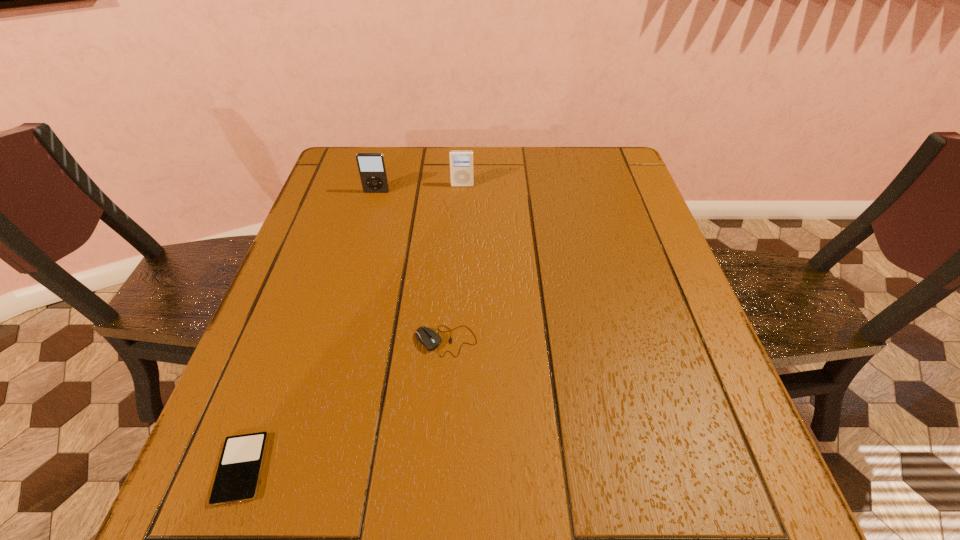
The height and width of the screenshot is (540, 960). I want to click on vacant position located on the right of the computer mouse, so click(624, 341).

This screenshot has width=960, height=540. What are the coordinates of `vacant space positioned on the back of the nearest iPod` in the screenshot? It's located at (314, 273).

The width and height of the screenshot is (960, 540). What are the coordinates of `object that is at the near edge` in the screenshot? It's located at coord(238,474).

The height and width of the screenshot is (540, 960). I want to click on object that is at the far left corner, so [371, 166].

Locate an element on the screen. object at the near left corner is located at coordinates (238, 474).

Locate an element on the screen. vacant space at the far edge of the desktop is located at coordinates (421, 156).

This screenshot has height=540, width=960. In the image, there is a desktop. In order to click on free space at the near edge in this screenshot , I will do `click(487, 530)`.

In the image, there is a desktop. Identify the location of vacant area at the left edge. Image resolution: width=960 pixels, height=540 pixels. (303, 334).

In the image, there is a desktop. At what (x,y) coordinates should I click in order to perform the action: click on vacant space at the right edge. Please return your answer as a coordinate pair (x, y). Looking at the image, I should click on (635, 223).

Find the location of a particular element. The height and width of the screenshot is (540, 960). vacant space at the far left corner of the desktop is located at coordinates (332, 180).